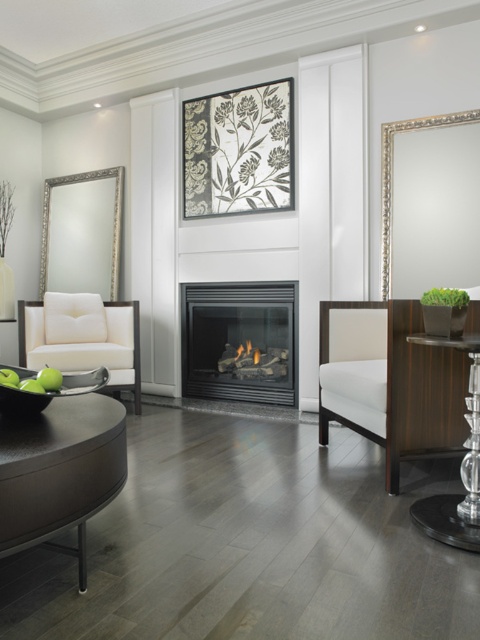
Does dark brown wooden table at lower left appear on the left side of clear glass table at lower right?

Indeed, dark brown wooden table at lower left is positioned on the left side of clear glass table at lower right.

The image size is (480, 640). I want to click on dark brown wooden table at lower left, so click(x=60, y=472).

Is point (268, 154) positioned in front of point (445, 524)?

No, it is not.

Who is taller, black textured fabric at upper center or clear glass table at lower right?

black textured fabric at upper center is taller.

Which is in front, point (237, 141) or point (452, 339)?

Positioned in front is point (452, 339).

Where is `black textured fabric at upper center`? black textured fabric at upper center is located at coordinates (239, 150).

Does point (82, 499) lie behind point (116, 390)?

No, (82, 499) is in front of (116, 390).

Does point (2, 454) lie in front of point (60, 358)?

That is True.

Which is behind, point (49, 525) or point (26, 362)?

Point (26, 362)

Where is `dark brown wooden table at lower left`? This screenshot has width=480, height=640. dark brown wooden table at lower left is located at coordinates (60, 472).